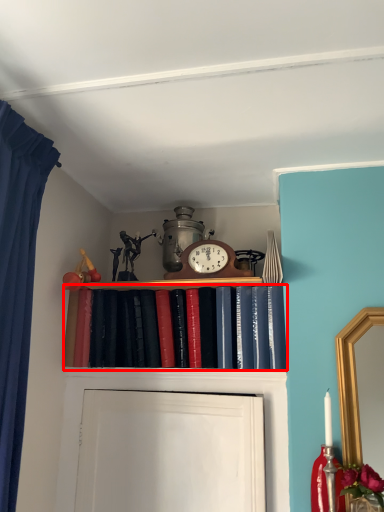
Question: From the image's perspective, where is book (annotated by the red box) located relative to alarm clock?

Choices:
 (A) below
 (B) above

Answer: (A)